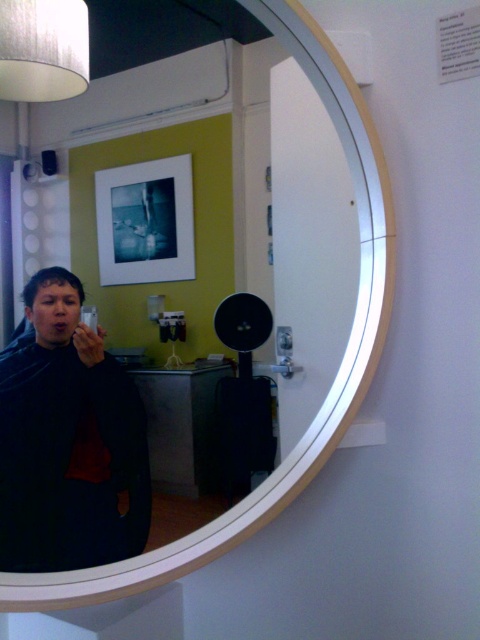
Question: Which of the following is the farthest from the observer?

Choices:
 (A) coord(6,532)
 (B) coord(242,301)

Answer: (B)

Question: Where is matte black shirt at left located in relation to matte black speaker at center in the image?

Choices:
 (A) left
 (B) right

Answer: (A)

Question: Can you confirm if matte black shirt at left is thinner than matte black speaker at center?

Choices:
 (A) no
 (B) yes

Answer: (A)

Question: Which of the following is the farthest from the observer?

Choices:
 (A) matte black speaker at center
 (B) matte black shirt at left

Answer: (A)

Question: Among these points, which one is nearest to the camera?

Choices:
 (A) (233, 294)
 (B) (101, 506)

Answer: (B)

Question: Can you confirm if matte black shirt at left is wider than matte black speaker at center?

Choices:
 (A) yes
 (B) no

Answer: (A)